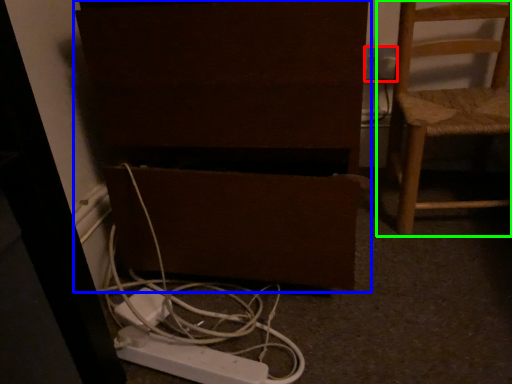
Question: Based on their relative distances, which object is nearer to electric outlet (highlighted by a red box)? Choose from furniture (highlighted by a blue box) and chair (highlighted by a green box).

Choices:
 (A) furniture
 (B) chair

Answer: (B)